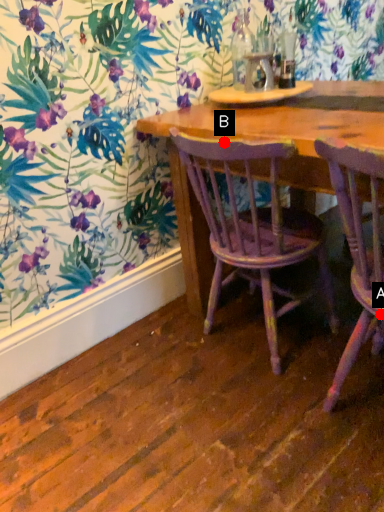
Question: Two points are circled on the image, labeled by A and B beside each circle. Which point is farther to the camera?

Choices:
 (A) A is further
 (B) B is further

Answer: (B)